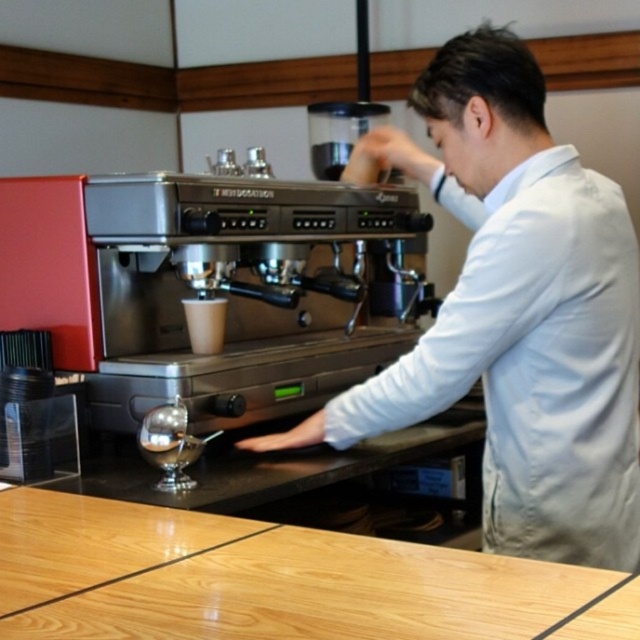
You are a customer at the cafe and want to place your phone on the counter near the espresso machine. Given that your phone is 15 cm long, can you determine if there is enough space on the wooden at center next to the metallic silver espresso machine at center?

The metallic silver espresso machine at center is larger than the wooden at center. Since the wooden at center is smaller, it might not have enough space for the phone. Please check the available space carefully.

You are a barista who needs to place a cup under the metallic silver espresso machine at center. Since the wooden at center is in the way, will you need to move it to access the area below the espresso machine?

The metallic silver espresso machine at center is above wooden at center, so the wooden at center is blocking the area below the espresso machine. Therefore, you will need to move the wooden at center to place the cup underneath.